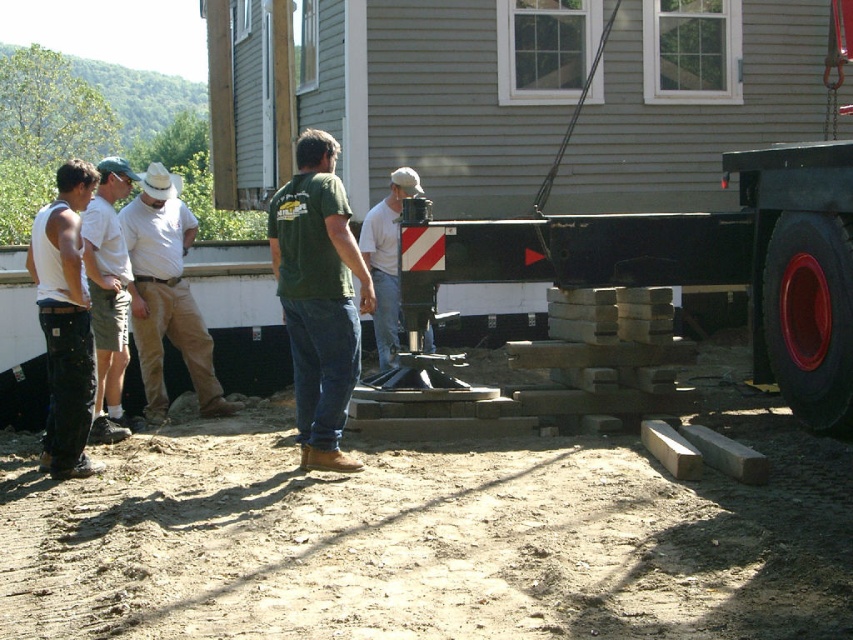
You are a construction worker who needs to deliver a tool to the person wearing denim pants at left without disturbing the person in light brown shorts at left. Which direction should you approach from?

You should approach from behind the light brown shorts at left since the denim pants at left is in front of light brown shorts at left, meaning the denim pants at left is closer to you. By going behind the light brown shorts at left, you can reach the denim pants at left without disturbing the other person.

You are a construction worker who needs to cross from the left side of the dirt ground to the right side. There are two workers wearing denim pants at left and khaki cotton pants at center. Which worker should you avoid stepping behind to ensure a clear path?

You should avoid stepping behind the khaki cotton pants at center because the denim pants at left is in front of them, blocking the direct path to the right side.